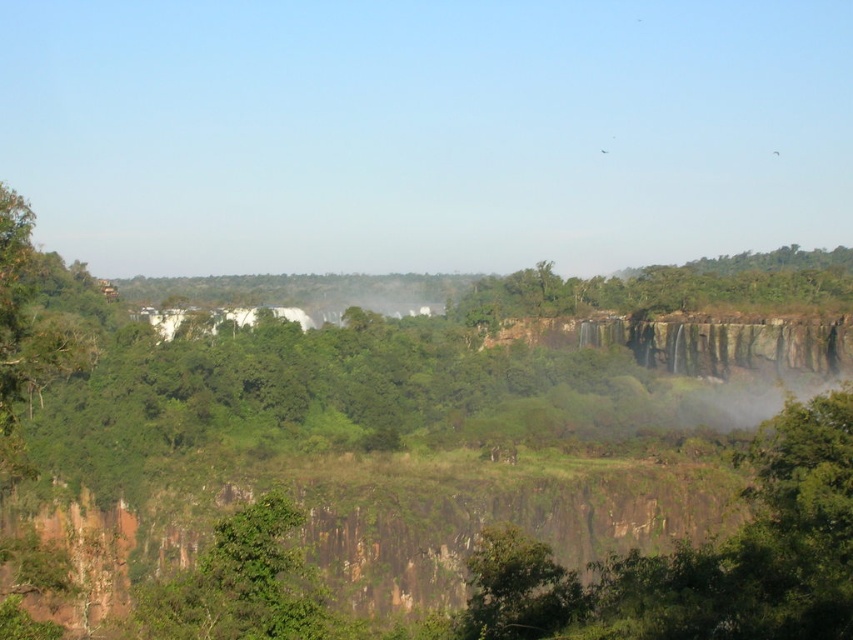
Is green leafy tree at upper center bigger than green leafy tree at center?

Yes.

Is green leafy tree at upper center taller than green leafy tree at center?

In fact, green leafy tree at upper center may be shorter than green leafy tree at center.

Is point (672, 307) positioned after point (325, 605)?

Yes.

Find the location of a particular element. The height and width of the screenshot is (640, 853). green leafy tree at upper center is located at coordinates (670, 288).